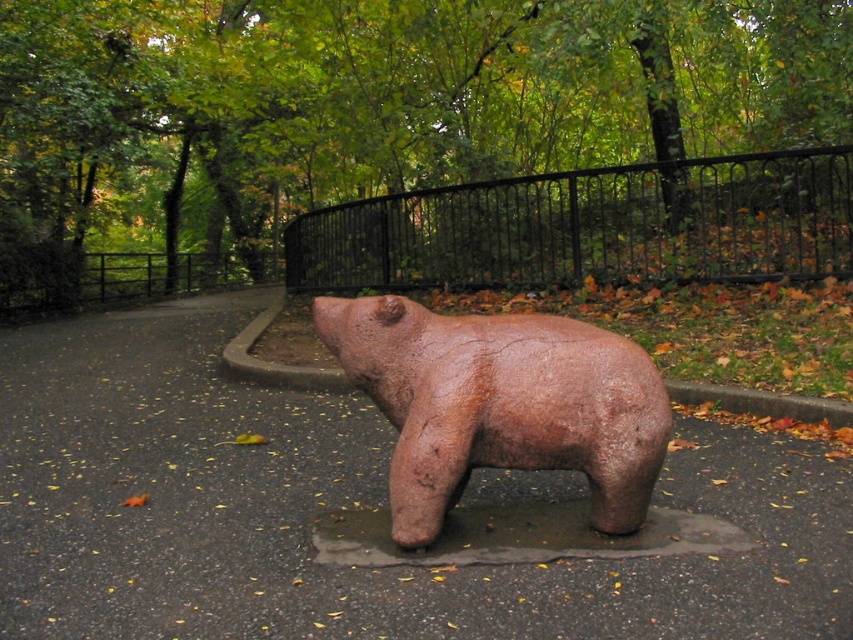
Question: Which of the following is the closest to the observer?

Choices:
 (A) brown matte bear at center
 (B) black wrought iron fence at upper center

Answer: (A)

Question: Does black wrought iron fence at upper center appear on the left side of brown matte bear at center?

Choices:
 (A) yes
 (B) no

Answer: (B)

Question: From the image, what is the correct spatial relationship of black wrought iron fence at upper center in relation to brown matte bear at center?

Choices:
 (A) above
 (B) below

Answer: (A)

Question: Does black wrought iron fence at upper center appear over brown matte bear at center?

Choices:
 (A) no
 (B) yes

Answer: (B)

Question: Which point is farther to the camera?

Choices:
 (A) brown matte bear at center
 (B) black wrought iron fence at upper center

Answer: (B)

Question: Among these points, which one is farthest from the camera?

Choices:
 (A) (502, 280)
 (B) (399, 442)

Answer: (A)